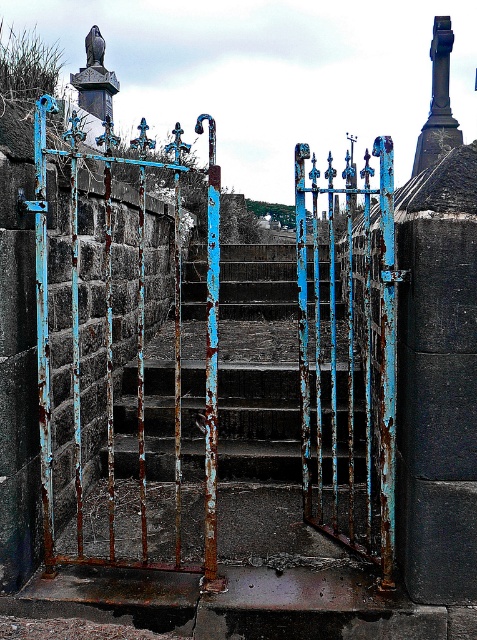
Question: Does rusty metal gate at center have a smaller size compared to rusty metal stairs at center?

Choices:
 (A) no
 (B) yes

Answer: (A)

Question: Which of the following is the farthest from the observer?

Choices:
 (A) rusty metal stairs at center
 (B) rusty metal gate at center

Answer: (A)

Question: Does rusty metal gate at center come behind rusty metal stairs at center?

Choices:
 (A) no
 (B) yes

Answer: (A)

Question: Is rusty metal gate at center positioned at the back of rusty metal stairs at center?

Choices:
 (A) no
 (B) yes

Answer: (A)